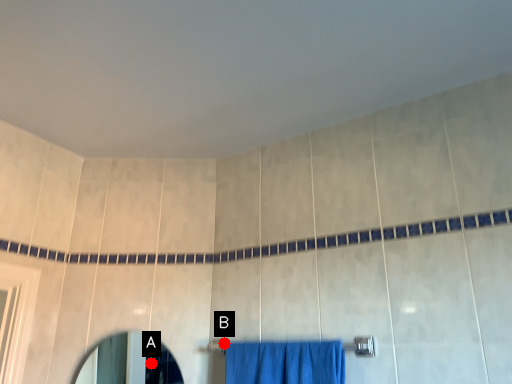
Question: Two points are circled on the image, labeled by A and B beside each circle. Which point is farther to the camera?

Choices:
 (A) A is further
 (B) B is further

Answer: (A)